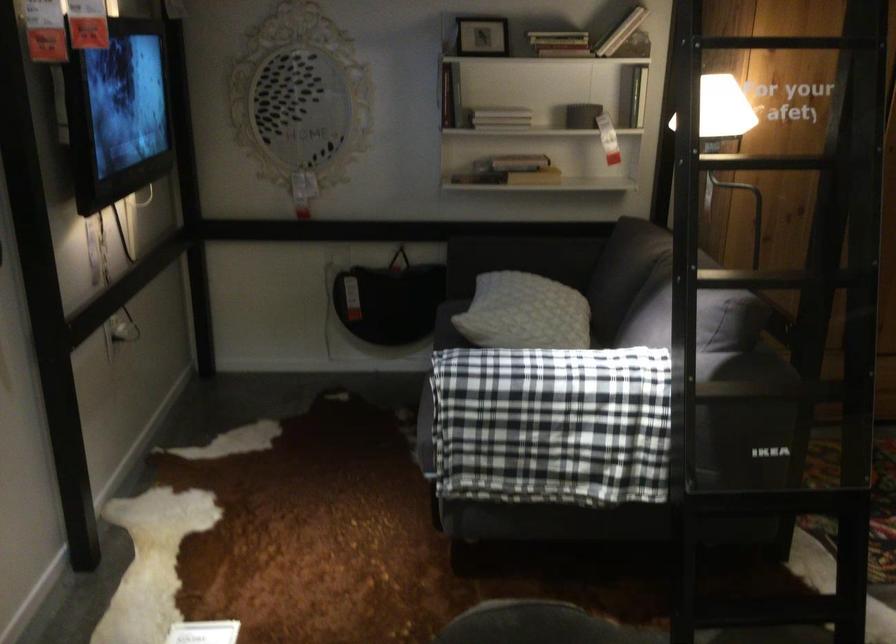
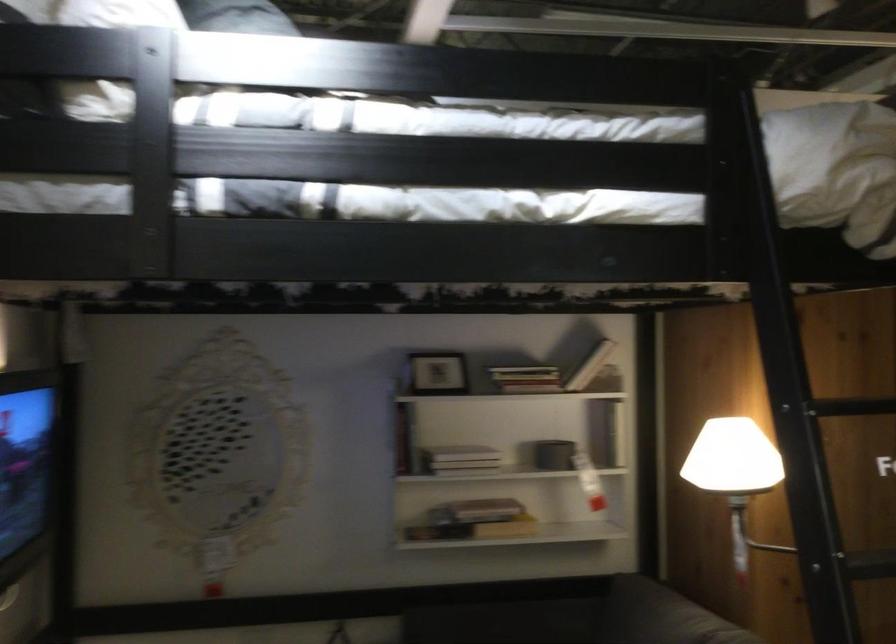
Where in the second image is the point corresponding to (510,152) from the first image?

(476, 511)